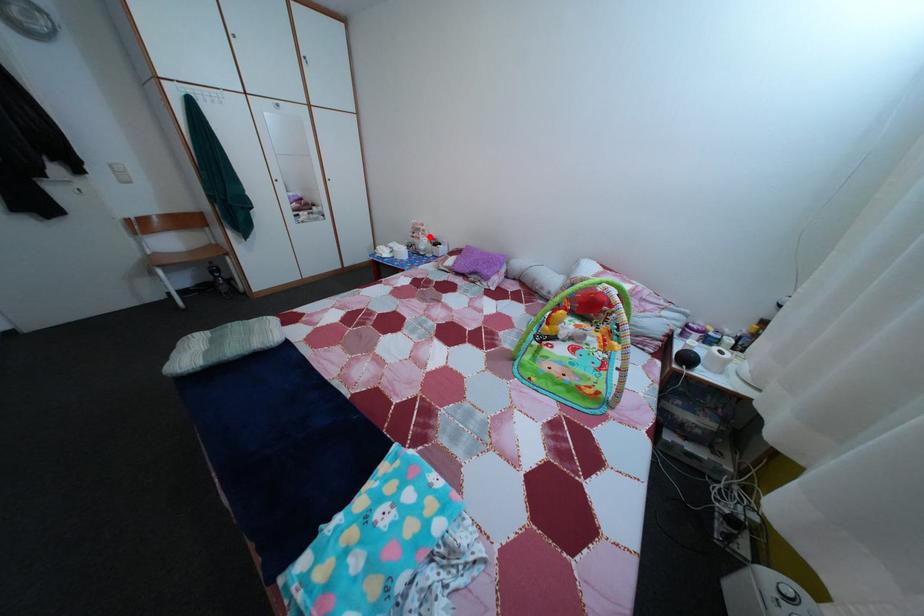
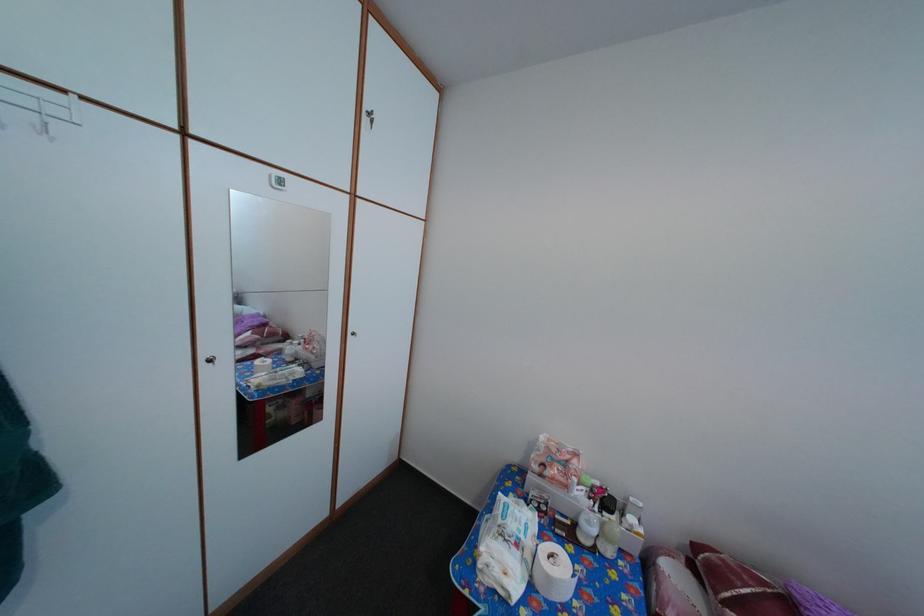
Question: I am providing you with two images of the same scene from different viewpoints. In image1, a red point is highlighted. Considering the same 3D point in image2, which of the following is correct?

Choices:
 (A) It is closer
 (B) It is farther

Answer: (B)